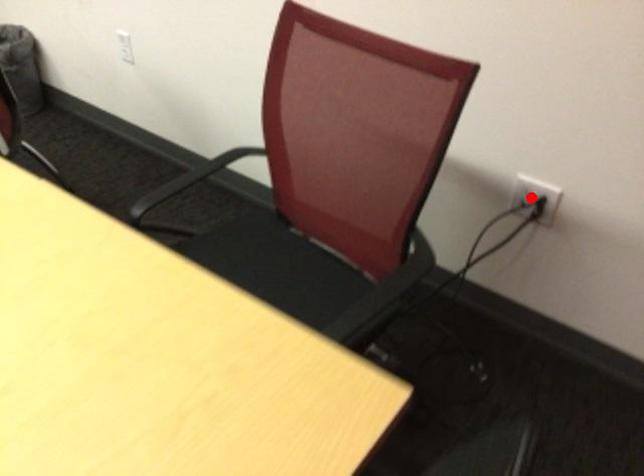
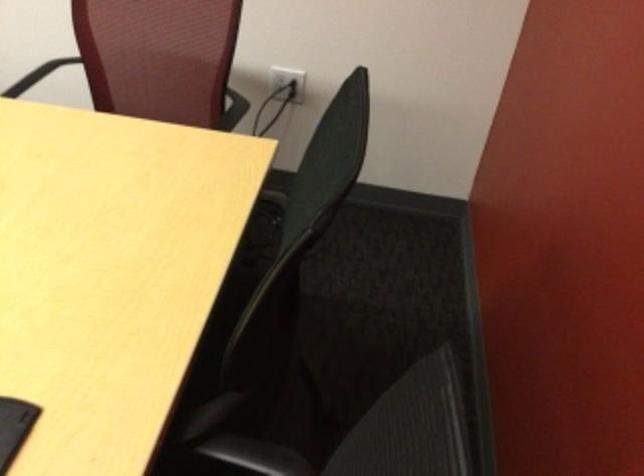
Question: I am providing you with two images of the same scene from different viewpoints. Given a red point in image1, look at the same physical point in image2. Is it:

Choices:
 (A) Closer to the viewpoint
 (B) Farther from the viewpoint

Answer: (B)